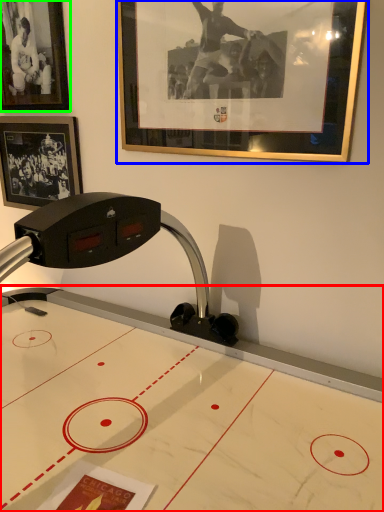
Question: Based on their relative distances, which object is nearer to table (highlighted by a red box)? Choose from picture frame (highlighted by a blue box) and picture frame (highlighted by a green box).

Choices:
 (A) picture frame
 (B) picture frame

Answer: (A)